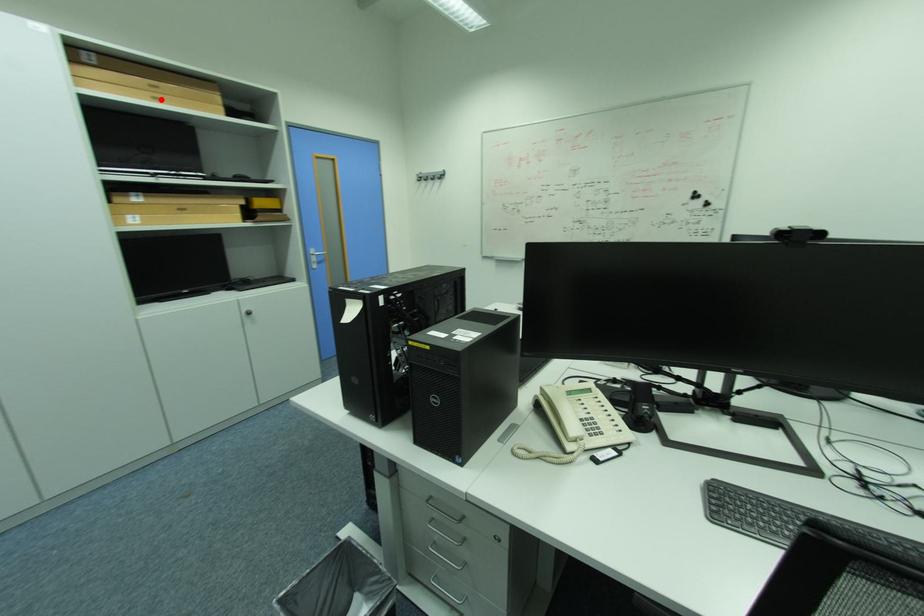
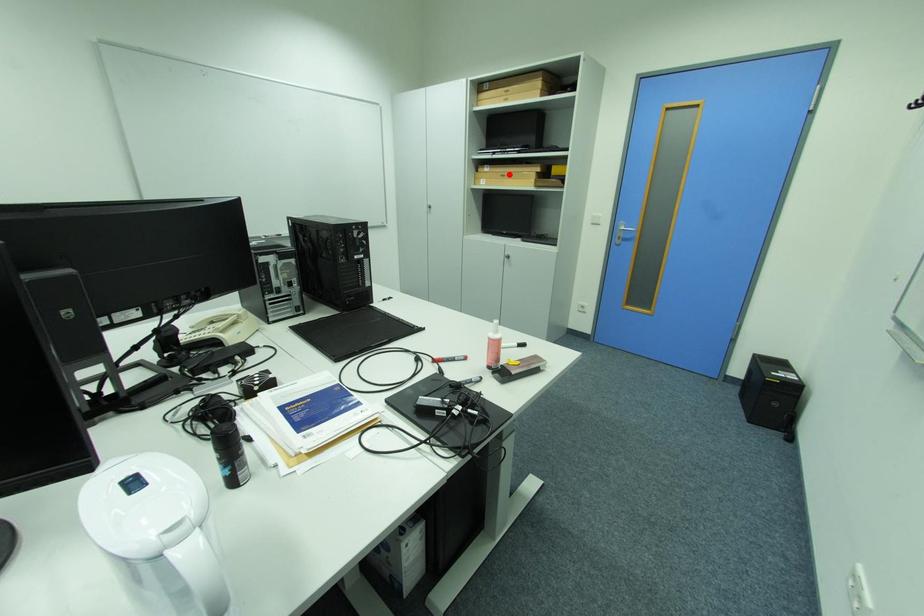
I am providing you with two images of the same scene from different viewpoints. A red point is marked on the first image and another point is marked on the second image. Does the point marked in image1 correspond to the same location as the one in image2?

No